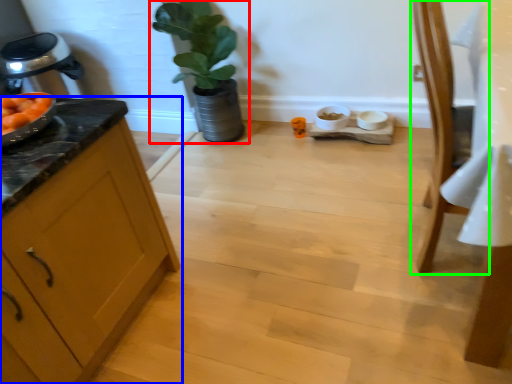
Question: Which is farther away from houseplant (highlighted by a red box)? cabinetry (highlighted by a blue box) or chair (highlighted by a green box)?

Choices:
 (A) cabinetry
 (B) chair

Answer: (B)